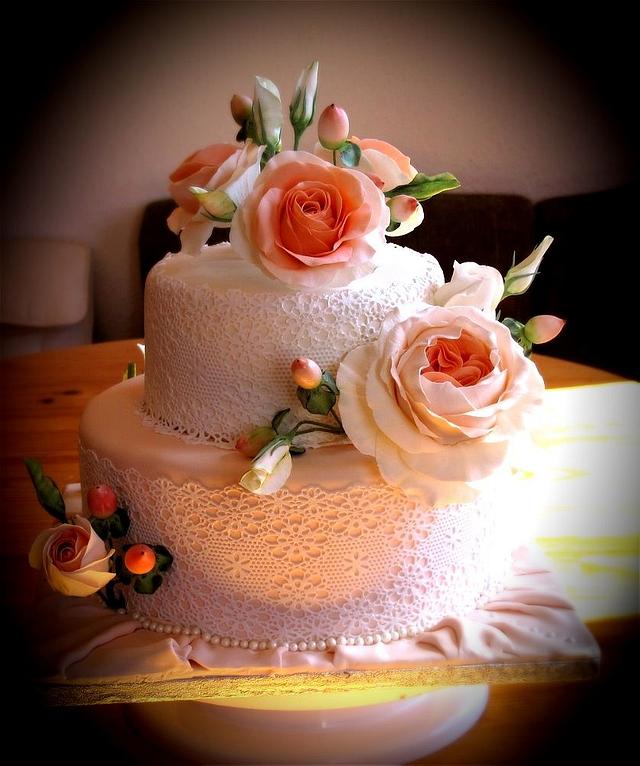
This screenshot has height=766, width=640. Find the location of `dark areas in corners`. dark areas in corners is located at coordinates [33, 59], [614, 30], [602, 728], [29, 731].